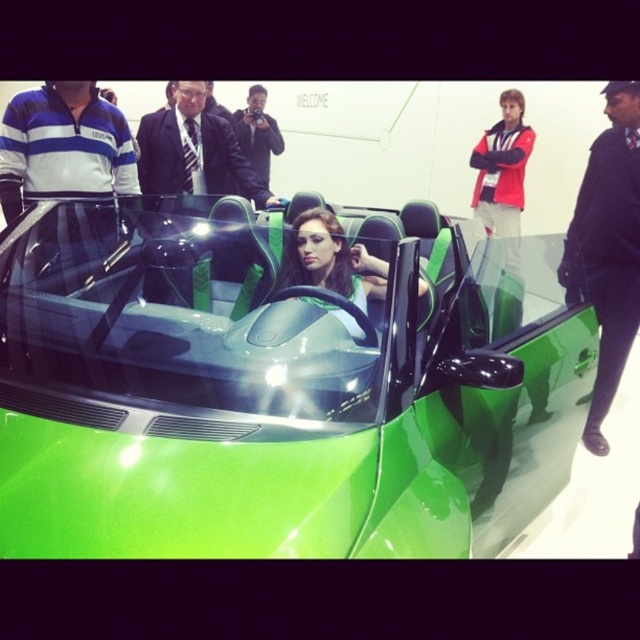
You are a photographer standing 2 meters away from the camera. You want to take a photo of the matte black suit at center without moving the camera. Is it possible to do so from your current position?

The matte black suit at center and camera are 3.53 meters apart. Since you are 2 meters away from the camera, the total distance between you and the matte black suit at center would be 5.53 meters. However, the question does not provide information about the camera lens capabilities or the required distance for focusing. Without knowing the camera specifications, it is impossible to determine if you can take the photo from that distance.

You are a photographer at the auto show and want to capture both the blue striped polo shirt at left and the matte black suit at center in a single frame. Which clothing item will appear smaller in the photo?

The blue striped polo shirt at left will appear smaller in the photo because it has a lesser height compared to the matte black suit at center.